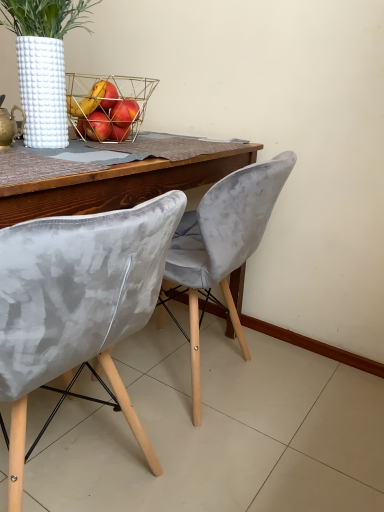
Question: Looking at their shapes, would you say gold wire basket at center is wider or thinner than velvet grey chair at center, placed as the 2th chair when sorted from back to front?

Choices:
 (A) thin
 (B) wide

Answer: (A)

Question: From a real-world perspective, is gold wire basket at center positioned above or below velvet grey chair at center, the first chair from the front?

Choices:
 (A) below
 (B) above

Answer: (B)

Question: Estimate the real-world distances between objects in this image. Which object is farther from the white textured vase at upper left?

Choices:
 (A) velvet grey chair at center, marked as the 2th chair in a front-to-back arrangement
 (B) gold wire basket at center
 (C) gold metallic teapot at upper left
 (D) velvet grey chair at center, the first chair from the front

Answer: (D)

Question: Considering the real-world distances, which object is farthest from the white textured vase at upper left?

Choices:
 (A) gold metallic teapot at upper left
 (B) velvet grey chair at center, which is the 1th chair in back-to-front order
 (C) velvet grey chair at center, the first chair from the front
 (D) gold wire basket at center

Answer: (C)